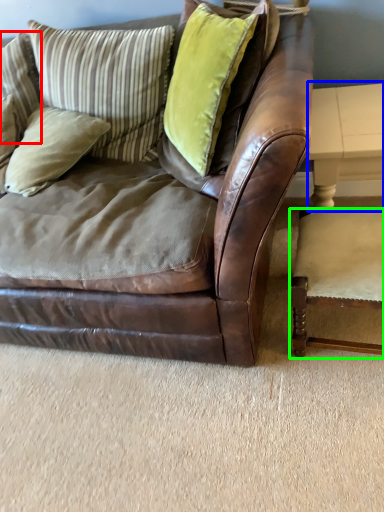
Question: Which object is positioned closest to pillow (highlighted by a red box)? Select from table (highlighted by a blue box) and chair (highlighted by a green box).

Choices:
 (A) table
 (B) chair

Answer: (A)